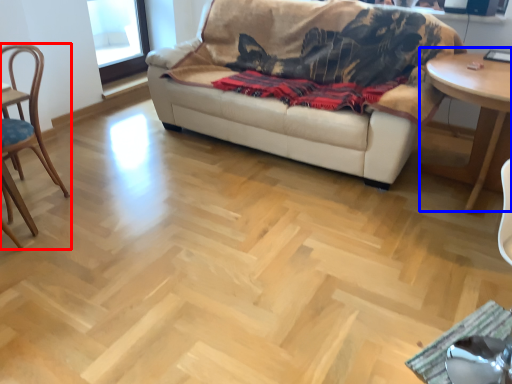
Question: Which point is closer to the camera, chair (highlighted by a red box) or table (highlighted by a blue box)?

Choices:
 (A) chair
 (B) table

Answer: (A)